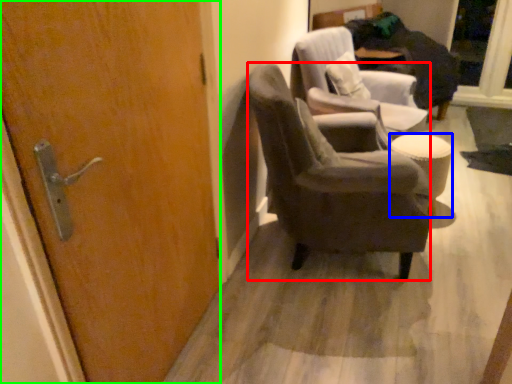
Question: Based on their relative distances, which object is nearer to chair (highlighted by a red box)? Choose from stool (highlighted by a blue box) and door (highlighted by a green box).

Choices:
 (A) stool
 (B) door

Answer: (A)